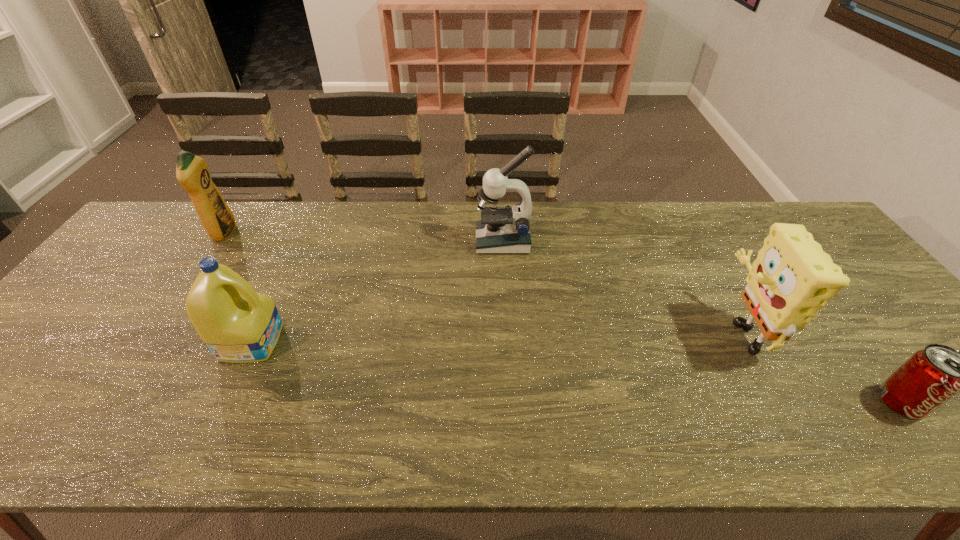
The height and width of the screenshot is (540, 960). In order to click on vacant space located on the face of the sponge in this screenshot , I will do `click(621, 330)`.

Image resolution: width=960 pixels, height=540 pixels. Find the location of `vacant space situated 0.060m on the face of the sponge`. vacant space situated 0.060m on the face of the sponge is located at coordinates (692, 330).

Find the location of a particular element. The height and width of the screenshot is (540, 960). free region located 0.370m on the label of the left detergent is located at coordinates (351, 233).

The width and height of the screenshot is (960, 540). I want to click on vacant point located 0.160m on the label of the right detergent, so click(345, 341).

Identify the location of vacant space situated on the back of the nearest object. (860, 348).

Identify the location of microscope located in the far edge section of the desktop. (501, 229).

Image resolution: width=960 pixels, height=540 pixels. Identify the location of detergent at the far edge. [x=192, y=172].

You are a GUI agent. You are given a task and a screenshot of the screen. Output one action in this format:
    pyautogui.click(x=<x>, y=<y>)
    Task: Click on the object at the near edge
    
    Given the screenshot: What is the action you would take?
    pyautogui.click(x=930, y=377)

This screenshot has width=960, height=540. In order to click on object situated at the right edge in this screenshot , I will do `click(930, 377)`.

Where is `object present at the near right corner`? The height and width of the screenshot is (540, 960). object present at the near right corner is located at coordinates (930, 377).